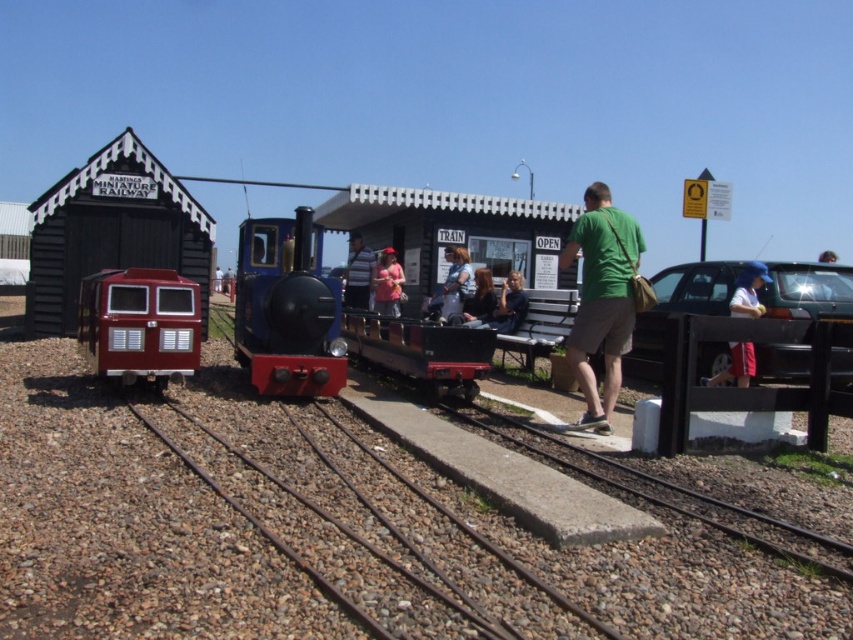
You are a photographer standing at the miniature railway station. You want to take a photo of both the matte blue shirt at center and the matte black jacket at center. However, you need to ensure that neither of them is blocking the other in the photo. Which person should be positioned closer to the camera to achieve this?

The matte blue shirt at center should be positioned closer to the camera because the matte black jacket at center is currently behind it, so moving the matte blue shirt forward will prevent the matte black jacket from being blocked.